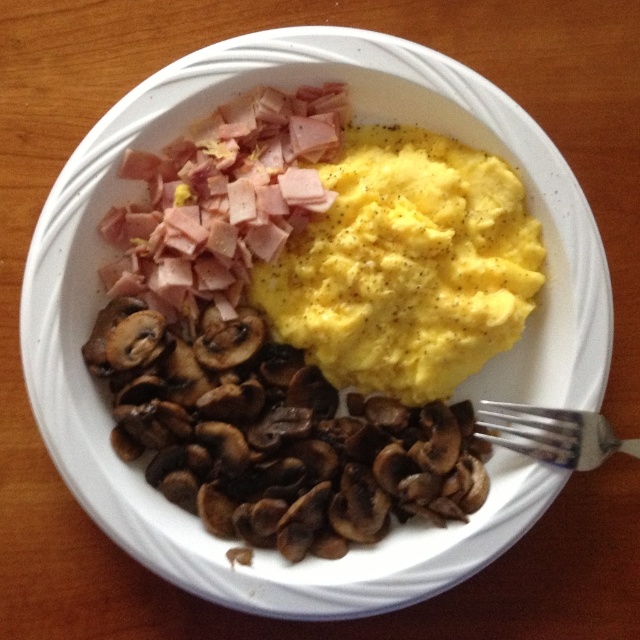
Question: Is the position of brown glossy mushrooms at left more distant than that of silver metallic fork at lower right?

Choices:
 (A) no
 (B) yes

Answer: (B)

Question: Which object appears closest to the camera in this image?

Choices:
 (A) silver metallic fork at lower right
 (B) yellow matte egg at center

Answer: (A)

Question: Observing the image, what is the correct spatial positioning of brown glossy mushrooms at left in reference to silver metallic fork at lower right?

Choices:
 (A) above
 (B) below

Answer: (A)

Question: Where is yellow matte egg at center located in relation to silver metallic fork at lower right in the image?

Choices:
 (A) right
 (B) left

Answer: (B)

Question: Which point is closer to the camera?

Choices:
 (A) brown glossy mushrooms at left
 (B) yellow matte egg at center
 (C) silver metallic fork at lower right

Answer: (C)

Question: Among these objects, which one is farthest from the camera?

Choices:
 (A) yellow matte egg at center
 (B) silver metallic fork at lower right

Answer: (A)